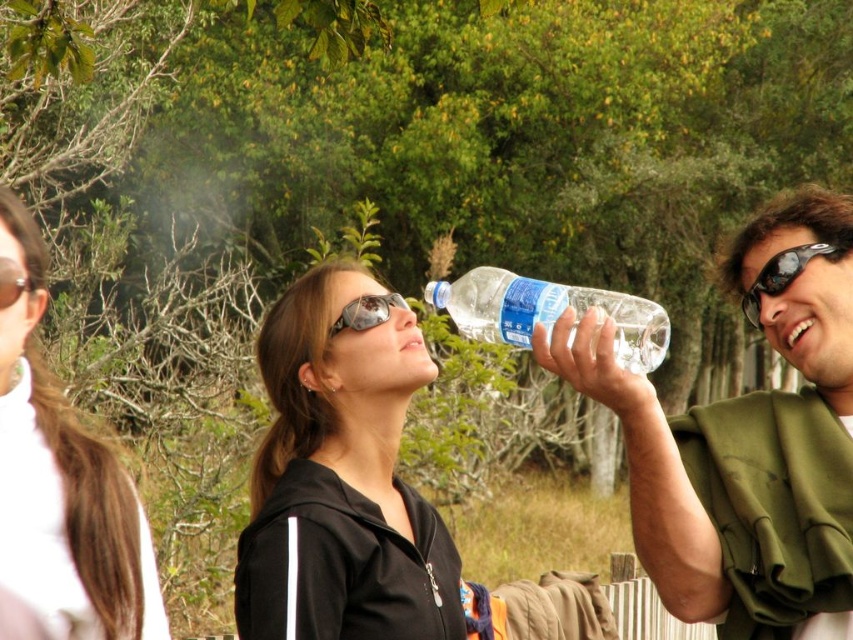
You are an observer in the scene. You have to determine if the black matte jacket at center can completely cover the matte black goggles at upper center if placed over it. Based on their sizes, what do you think?

The black matte jacket at center is wider than the matte black goggles at upper center, so yes, the jacket could potentially cover the goggles if positioned over them.

You are taking a photo of the two people in the scene. You want to focus on the person at point (x=387, y=472) first. Will the person at point (x=19, y=284) also be in focus if you focus on the first person?

Since point (x=387, y=472) is further to the camera than point (x=19, y=284), focusing on the person at point (x=387, y=472) will not ensure the person at point (x=19, y=284) is in focus because they are at different distances from the camera.

You are a photographer trying to capture a candid shot of the two people in the scene. You notice the black matte jacket at center and the matte black goggles at upper center. Which object should you focus on first if you want to ensure both are in the frame without moving the camera?

The black matte jacket at center is much taller than the matte black goggles at upper center, so focusing on the taller black matte jacket at center first would ensure both are within the frame as the goggles are smaller and positioned above.